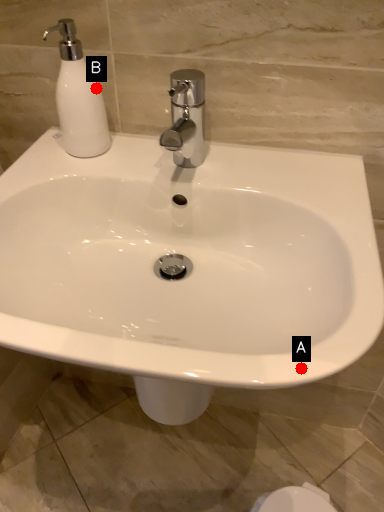
Question: Two points are circled on the image, labeled by A and B beside each circle. Which point appears closest to the camera in this image?

Choices:
 (A) A is closer
 (B) B is closer

Answer: (A)